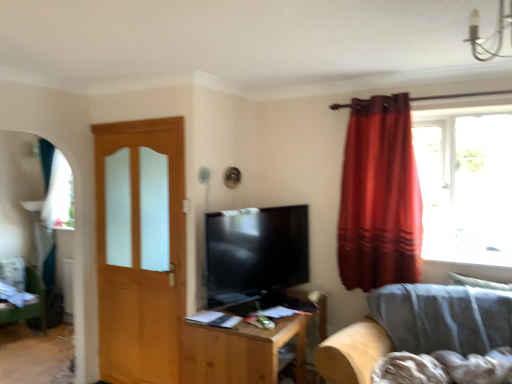
Question: From a real-world perspective, is matte black tv at center above or below gray fabric couch at lower right?

Choices:
 (A) above
 (B) below

Answer: (A)

Question: From the image's perspective, is matte black tv at center above or below gray fabric couch at lower right?

Choices:
 (A) above
 (B) below

Answer: (A)

Question: Estimate the real-world distances between objects in this image. Which object is closer to the wooden table at center?

Choices:
 (A) matte black tv at center
 (B) light brown wooden door at left
 (C) satin red curtain at right
 (D) green fabric swivel chair at lower left
 (E) white glass chandelier at upper right

Answer: (A)

Question: Which is nearer to the wooden table at center?

Choices:
 (A) matte black tv at center
 (B) satin red curtain at right
 (C) white glass chandelier at upper right
 (D) light brown wooden door at left
 (E) green fabric swivel chair at lower left

Answer: (A)